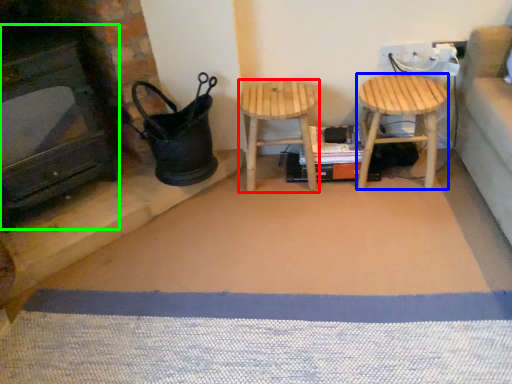
Question: Considering the real-world distances, which object is closest to stool (highlighted by a red box)? stool (highlighted by a blue box) or fireplace (highlighted by a green box).

Choices:
 (A) stool
 (B) fireplace

Answer: (A)